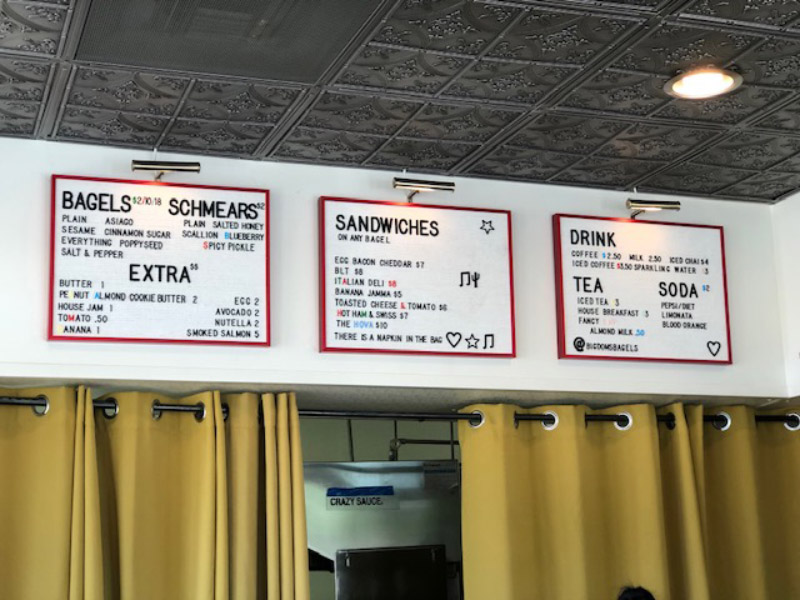
This screenshot has width=800, height=600. Find the location of `curtain`. curtain is located at coordinates (165, 496), (640, 485).